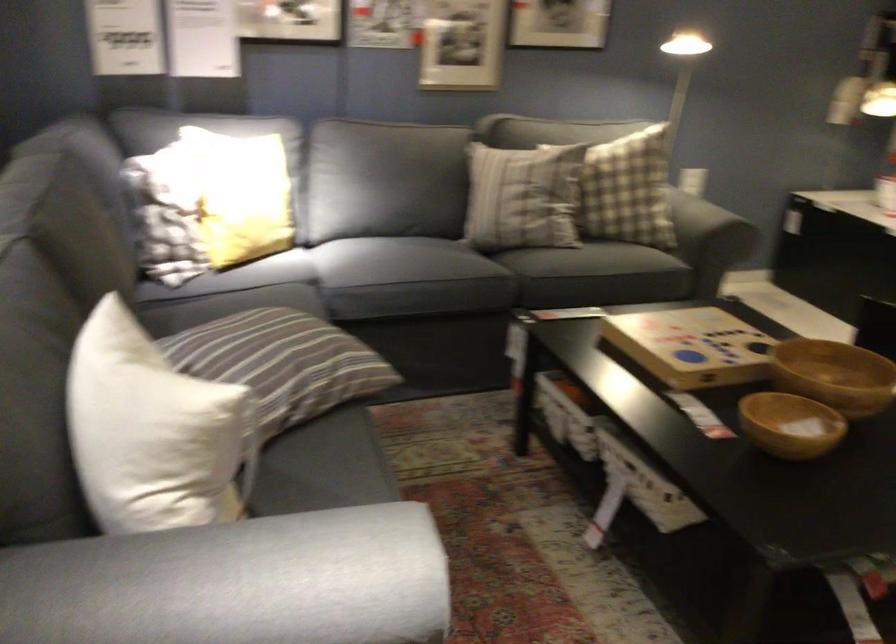
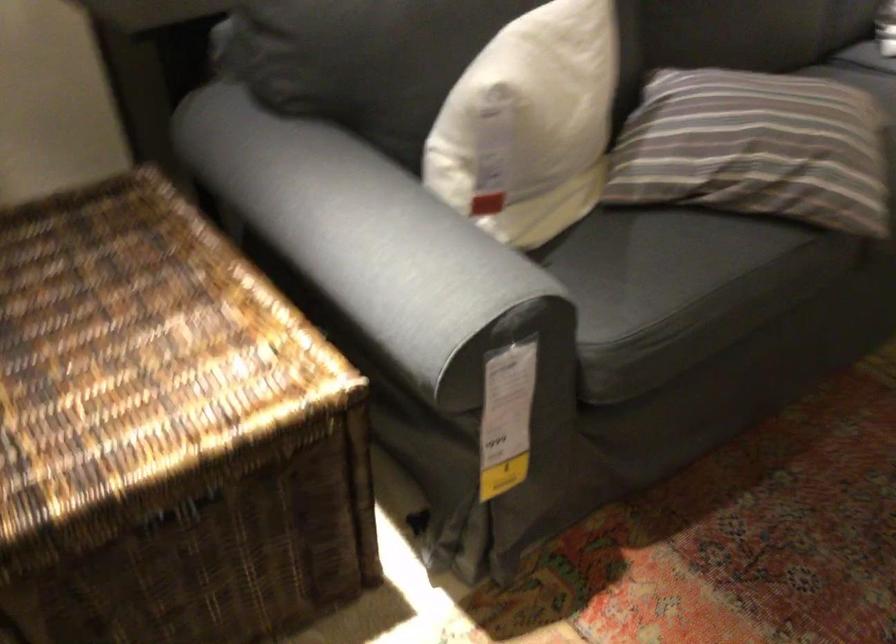
First-person continuous shooting, in which direction is the camera rotating?

The camera rotated toward left-down.